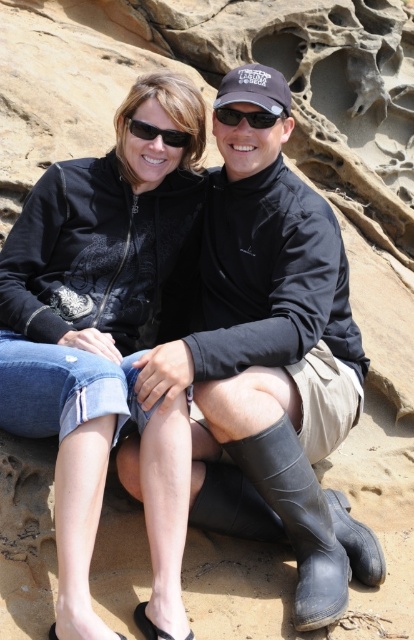
Question: Is black matte sunglasses at upper center below black plastic sunglasses at upper center?

Choices:
 (A) yes
 (B) no

Answer: (A)

Question: Considering the relative positions of black rubber boot at lower center and black matte sunglasses at upper center in the image provided, where is black rubber boot at lower center located with respect to black matte sunglasses at upper center?

Choices:
 (A) right
 (B) left

Answer: (A)

Question: Among these points, which one is farthest from the camera?

Choices:
 (A) (142, 125)
 (B) (315, 492)
 (C) (262, 113)

Answer: (A)

Question: Is black rubber boot at lower center thinner than black matte sunglasses at upper center?

Choices:
 (A) no
 (B) yes

Answer: (A)

Question: Which point is closer to the camera?

Choices:
 (A) black rubber boot at lower center
 (B) black plastic sunglasses at upper center

Answer: (A)

Question: Among these objects, which one is farthest from the camera?

Choices:
 (A) black plastic sunglasses at upper center
 (B) black matte sunglasses at upper center

Answer: (B)